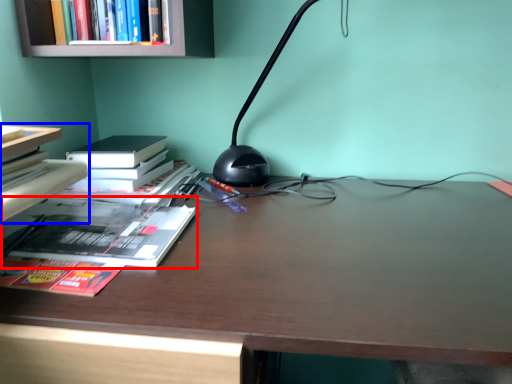
Question: Which point is further to the camera, book (highlighted by a red box) or book (highlighted by a blue box)?

Choices:
 (A) book
 (B) book

Answer: (A)